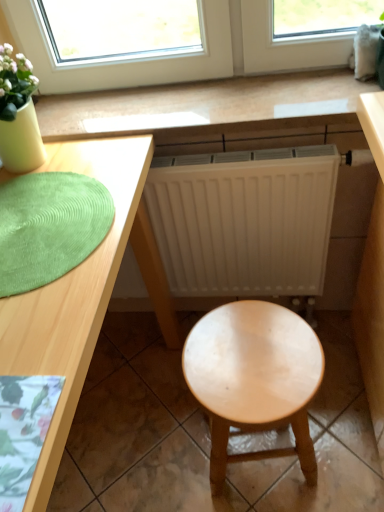
Question: Does green textured mat at left lie in front of light wood desk at center?

Choices:
 (A) no
 (B) yes

Answer: (A)

Question: Does green textured mat at left appear on the left side of light wood desk at center?

Choices:
 (A) no
 (B) yes

Answer: (A)

Question: Is green textured mat at left outside light wood desk at center?

Choices:
 (A) no
 (B) yes

Answer: (A)

Question: From a real-world perspective, does green textured mat at left sit lower than light wood desk at center?

Choices:
 (A) no
 (B) yes

Answer: (A)

Question: Can you see green textured mat at left touching light wood desk at center?

Choices:
 (A) no
 (B) yes

Answer: (B)

Question: Is wooden table at center inside the boundaries of light wood desk at center, or outside?

Choices:
 (A) outside
 (B) inside

Answer: (A)

Question: From a real-world perspective, is wooden table at center positioned above or below light wood desk at center?

Choices:
 (A) below
 (B) above

Answer: (B)

Question: From the image's perspective, relative to light wood desk at center, is wooden table at center above or below?

Choices:
 (A) below
 (B) above

Answer: (B)

Question: Is point (94, 120) closer or farther from the camera than point (105, 292)?

Choices:
 (A) closer
 (B) farther

Answer: (B)

Question: Is green textured mat at left inside the boundaries of light wood desk at center, or outside?

Choices:
 (A) outside
 (B) inside

Answer: (B)

Question: From the image's perspective, relative to light wood desk at center, is green textured mat at left above or below?

Choices:
 (A) below
 (B) above

Answer: (B)

Question: In the image, is green textured mat at left on the left side or the right side of light wood desk at center?

Choices:
 (A) right
 (B) left

Answer: (A)

Question: In terms of width, does green textured mat at left look wider or thinner when compared to light wood desk at center?

Choices:
 (A) wide
 (B) thin

Answer: (B)

Question: In terms of height, does green textured mat at left look taller or shorter compared to light brown wood stool at center?

Choices:
 (A) tall
 (B) short

Answer: (B)

Question: In terms of size, does green textured mat at left appear bigger or smaller than light brown wood stool at center?

Choices:
 (A) big
 (B) small

Answer: (B)